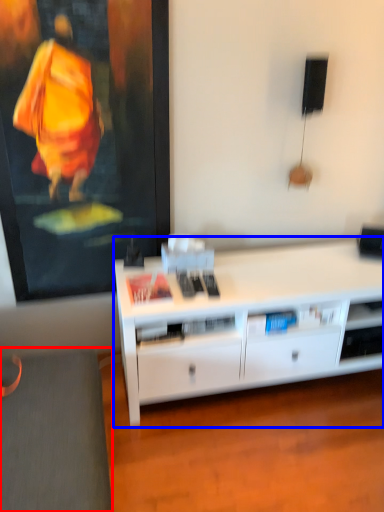
Question: Which point is closer to the camera, gray (highlighted by a red box) or desk (highlighted by a blue box)?

Choices:
 (A) gray
 (B) desk

Answer: (A)